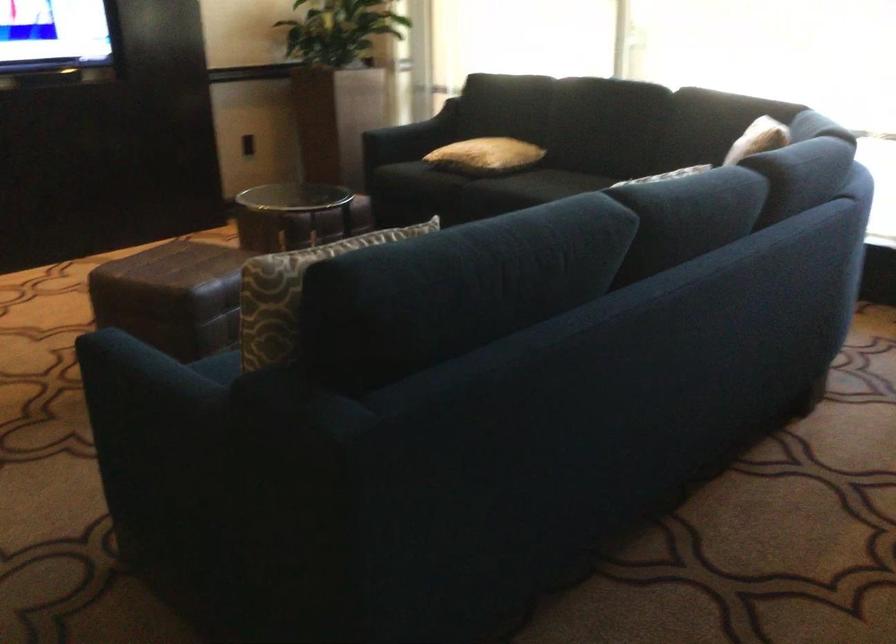
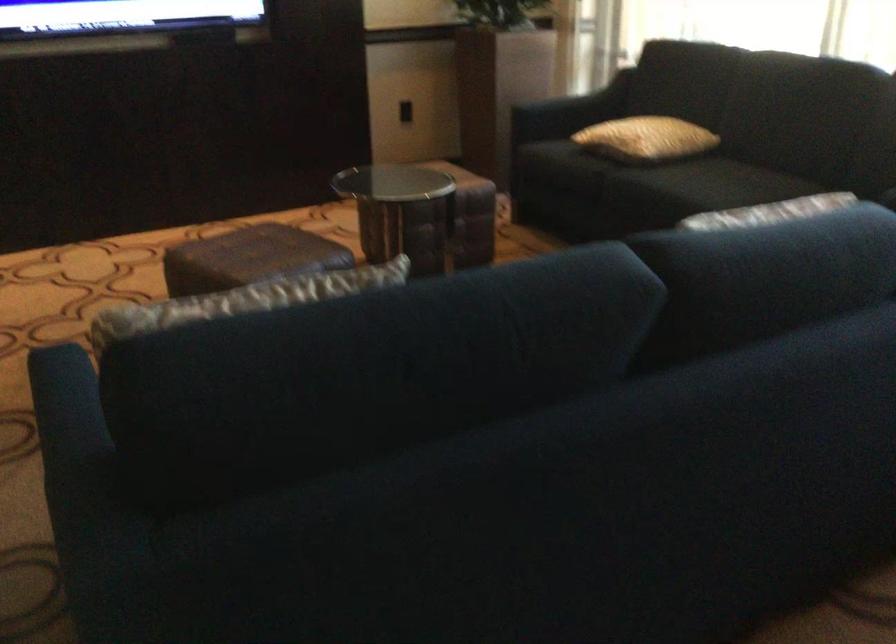
Where in the second image is the point corresponding to pixel 424 128 from the first image?

(586, 99)